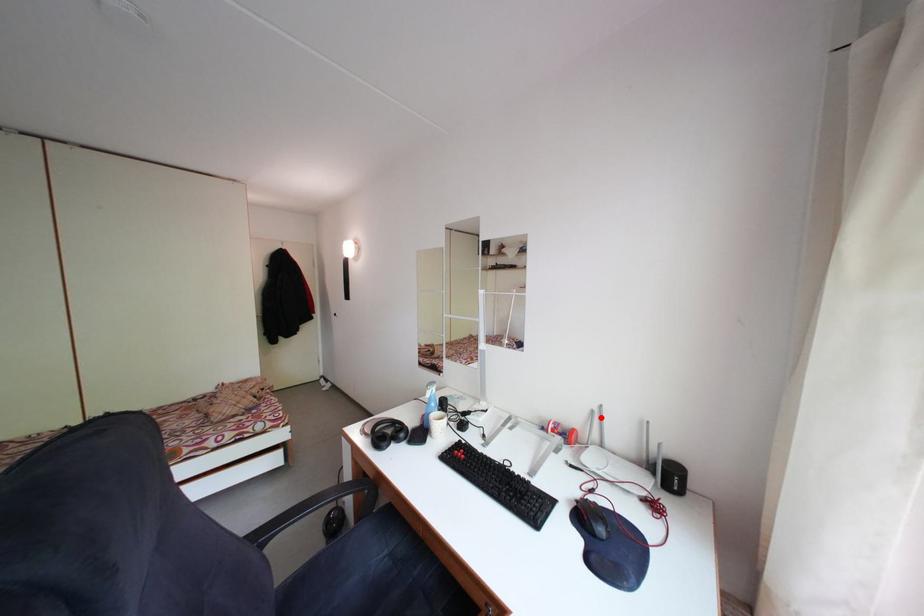
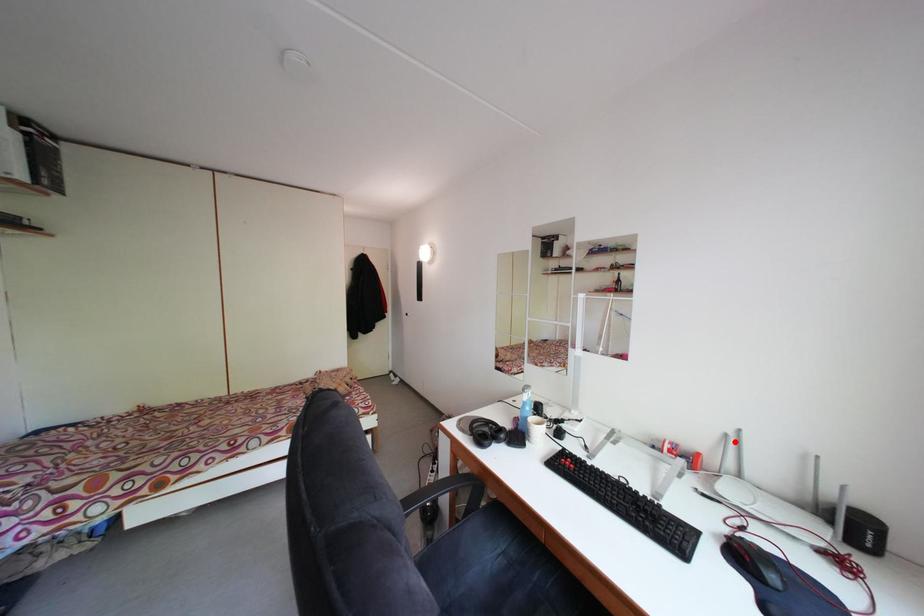
I am providing you with two images of the same scene from different viewpoints. A red point is marked on the first image and another point is marked on the second image. Is the red point in image1 aligned with the point shown in image2?

Yes